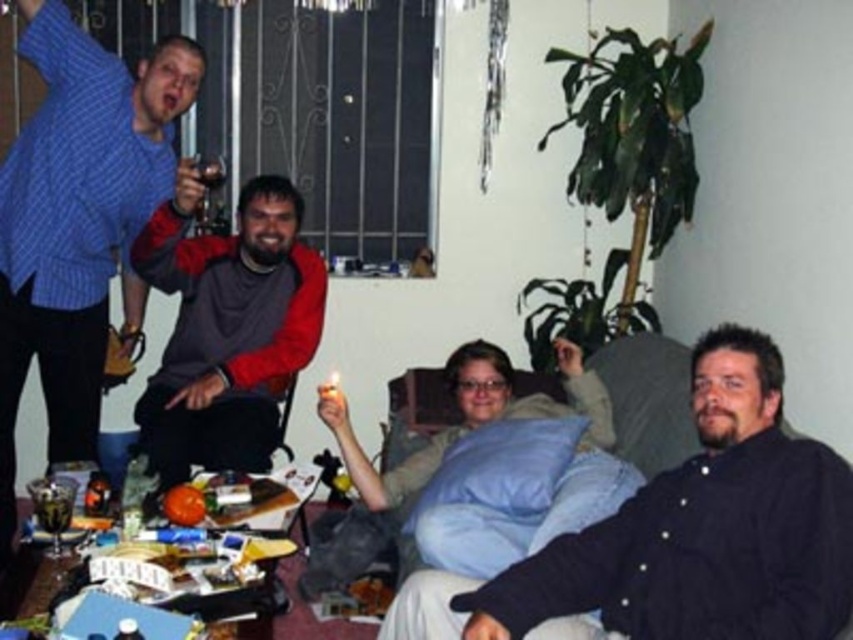
You are a photographer standing in the living room and want to take a photo of the blue plaid shirt at upper left and the metallic silver can at upper left. Which object will appear larger in the photo?

The blue plaid shirt at upper left will appear larger in the photo because it is closer to the viewer than the metallic silver can at upper left.

You are standing at point [33,118] and want to walk to the coffee table in the foreground. Is the point [751,557] in your direct path?

Yes, because point [751,557] is in front of point [33,118], so it lies along your path towards the coffee table.

You are trying to place a new small item on the table. The blue plaid shirt at upper left and the metallic silver can at upper left are already on the table. Which object should you move to make space if you want to place the item near the upper left corner?

You should move the blue plaid shirt at upper left because it might be wider than the metallic silver can at upper left, providing more space.